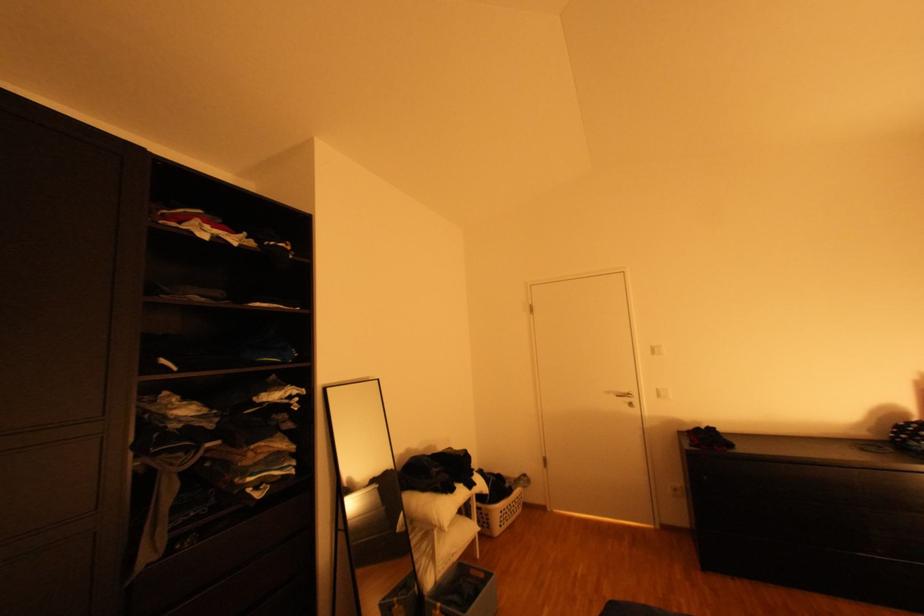
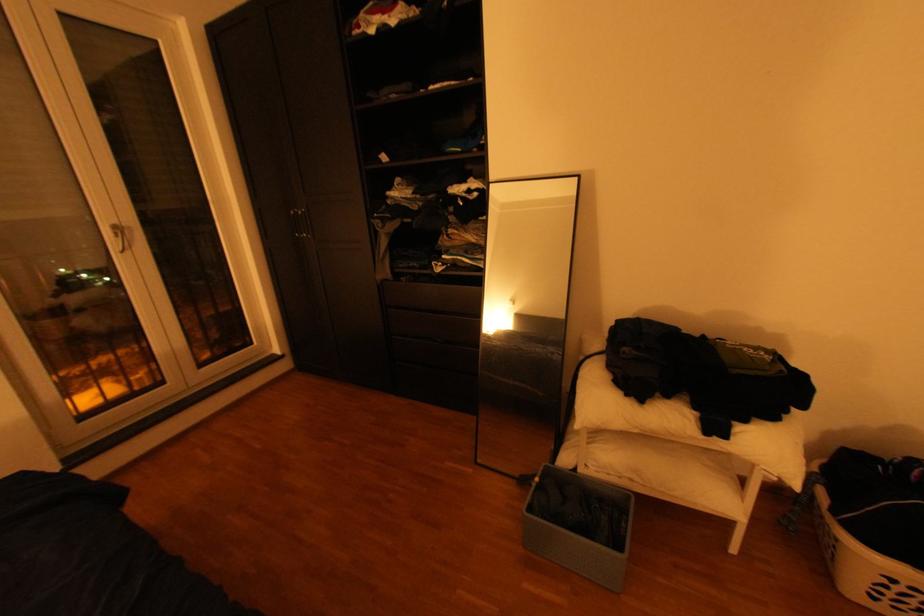
Question: I am providing you with two images of the same scene from different viewpoints. After the viewpoint changes to image2, which objects are now occluded?

Choices:
 (A) drawer pull
 (B) white pillow
 (C) black cabinet handle
 (D) none of these

Answer: (D)